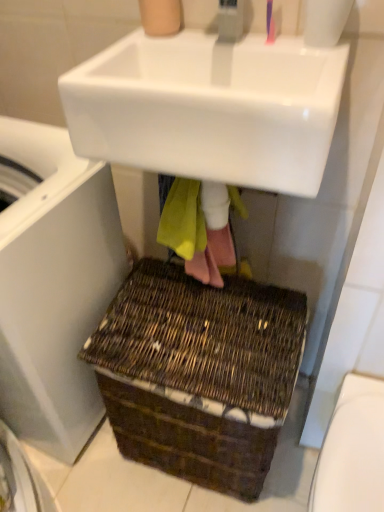
The height and width of the screenshot is (512, 384). What do you see at coordinates (53, 284) in the screenshot?
I see `white plastic washing machine at lower left` at bounding box center [53, 284].

This screenshot has width=384, height=512. Describe the element at coordinates (270, 23) in the screenshot. I see `pink plastic toothbrush at upper center` at that location.

Locate an element on the screen. Image resolution: width=384 pixels, height=512 pixels. brown woven basket at lower center is located at coordinates (199, 373).

Is white glossy sink at upper center facing towards white glossy toilet bowl at lower right?

No, white glossy sink at upper center is not facing towards white glossy toilet bowl at lower right.

Does white glossy sink at upper center contain white glossy toilet bowl at lower right?

Actually, white glossy toilet bowl at lower right is outside white glossy sink at upper center.

Is there a large distance between white glossy sink at upper center and white glossy toilet bowl at lower right?

white glossy sink at upper center is actually quite close to white glossy toilet bowl at lower right.

Which is in front, point (147, 41) or point (352, 447)?

Point (352, 447)

Image resolution: width=384 pixels, height=512 pixels. In the image, there is a brown woven basket at lower center. Identify the location of sink above it (from the image's perspective). (210, 108).

Is white glossy sink at upper center a part of brown woven basket at lower center?

No, white glossy sink at upper center is not a part of brown woven basket at lower center.

From their relative heights in the image, would you say brown woven basket at lower center is taller or shorter than white glossy sink at upper center?

Considering their sizes, brown woven basket at lower center has more height than white glossy sink at upper center.

Is the position of brown woven basket at lower center more distant than that of white glossy sink at upper center?

Answer: Yes, brown woven basket at lower center is behind white glossy sink at upper center.

Is pink plastic toothbrush at upper center spatially inside white plastic washing machine at lower left, or outside of it?

pink plastic toothbrush at upper center lies outside white plastic washing machine at lower left.

Who is smaller, pink plastic toothbrush at upper center or white plastic washing machine at lower left?

With smaller size is pink plastic toothbrush at upper center.

I want to click on toothbrush lying above the white plastic washing machine at lower left (from the image's perspective), so click(270, 23).

Find the location of `basket below the white plastic washing machine at lower left (from a real-world perspective)`. basket below the white plastic washing machine at lower left (from a real-world perspective) is located at coordinates (199, 373).

Considering the sizes of objects white plastic washing machine at lower left and brown woven basket at lower center in the image provided, who is bigger, white plastic washing machine at lower left or brown woven basket at lower center?

white plastic washing machine at lower left is bigger.

Who is taller, white plastic washing machine at lower left or brown woven basket at lower center?

Standing taller between the two is white plastic washing machine at lower left.

Which is in front, point (36, 285) or point (290, 326)?

Point (36, 285)

Consider the image. Is brown woven basket at lower center looking in the opposite direction of white plastic washing machine at lower left?

No.

Looking at their sizes, would you say brown woven basket at lower center is wider or thinner than white plastic washing machine at lower left?

In the image, brown woven basket at lower center appears to be more narrow than white plastic washing machine at lower left.

From a real-world perspective, is brown woven basket at lower center located higher than white plastic washing machine at lower left?

No, from a real-world perspective, brown woven basket at lower center is not on top of white plastic washing machine at lower left.

Locate an element on the screen. The image size is (384, 512). basket below the white plastic washing machine at lower left (from a real-world perspective) is located at coordinates (199, 373).

Is white glossy toilet bowl at lower right placed right next to white plastic washing machine at lower left?

white glossy toilet bowl at lower right and white plastic washing machine at lower left are not in contact.

Is white glossy toilet bowl at lower right not inside white plastic washing machine at lower left?

Absolutely, white glossy toilet bowl at lower right is external to white plastic washing machine at lower left.

What's the angular difference between white glossy toilet bowl at lower right and white plastic washing machine at lower left's facing directions?

There is a 85.5-degree angle between the facing directions of white glossy toilet bowl at lower right and white plastic washing machine at lower left.

Find the location of a particular element. Image resolution: width=384 pixels, height=512 pixels. toilet bowl below the white plastic washing machine at lower left (from the image's perspective) is located at coordinates (352, 450).

Is white plastic washing machine at lower left positioned in front of white glossy toilet bowl at lower right?

Yes, it is in front of white glossy toilet bowl at lower right.

Can you tell me how much white plastic washing machine at lower left and white glossy toilet bowl at lower right differ in facing direction?

white plastic washing machine at lower left and white glossy toilet bowl at lower right are facing 85.5 degrees away from each other.

Is white plastic washing machine at lower left not inside white glossy toilet bowl at lower right?

Yes.

Locate an element on the screen. This screenshot has height=512, width=384. toilet bowl behind the white glossy sink at upper center is located at coordinates (352, 450).

Locate an element on the screen. This screenshot has width=384, height=512. sink in front of the brown woven basket at lower center is located at coordinates (210, 108).

Estimate the real-world distances between objects in this image. Which object is further from white glossy toilet bowl at lower right, white plastic washing machine at lower left or pink plastic toothbrush at upper center?

Among the two, pink plastic toothbrush at upper center is located further to white glossy toilet bowl at lower right.

Which object lies further to the anchor point white glossy toilet bowl at lower right, white glossy sink at upper center or brown woven basket at lower center?

Among the two, white glossy sink at upper center is located further to white glossy toilet bowl at lower right.

From the picture: Considering their positions, is pink plastic toothbrush at upper center positioned further to white plastic washing machine at lower left than white glossy sink at upper center?

pink plastic toothbrush at upper center is further to white plastic washing machine at lower left.

Considering their positions, is brown woven basket at lower center positioned further to white plastic washing machine at lower left than white glossy toilet bowl at lower right?

Among the two, white glossy toilet bowl at lower right is located further to white plastic washing machine at lower left.

Based on the photo, looking at the image, which one is located further to brown woven basket at lower center, white glossy sink at upper center or white plastic washing machine at lower left?

Among the two, white glossy sink at upper center is located further to brown woven basket at lower center.

Based on their spatial positions, is white glossy toilet bowl at lower right or white glossy sink at upper center further from pink plastic toothbrush at upper center?

white glossy toilet bowl at lower right is further to pink plastic toothbrush at upper center.

Estimate the real-world distances between objects in this image. Which object is closer to white plastic washing machine at lower left, white glossy sink at upper center or brown woven basket at lower center?

brown woven basket at lower center.

From the image, which object appears to be farther from white glossy sink at upper center, white plastic washing machine at lower left or white glossy toilet bowl at lower right?

white glossy toilet bowl at lower right is positioned further to the anchor white glossy sink at upper center.

Locate an element on the screen. The height and width of the screenshot is (512, 384). basket between white glossy sink at upper center and white glossy toilet bowl at lower right vertically is located at coordinates (199, 373).

Find the location of a particular element. sink between pink plastic toothbrush at upper center and white glossy toilet bowl at lower right in the up-down direction is located at coordinates (210, 108).

Find the location of a particular element. Image resolution: width=384 pixels, height=512 pixels. sink located between white plastic washing machine at lower left and pink plastic toothbrush at upper center in the left-right direction is located at coordinates tap(210, 108).

I want to click on basket located between white plastic washing machine at lower left and white glossy toilet bowl at lower right in the left-right direction, so click(x=199, y=373).